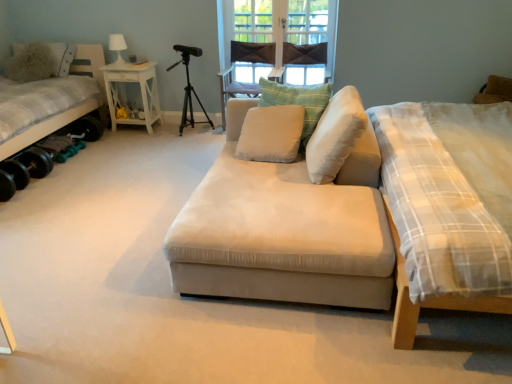
What are the coordinates of `free space to the left of beige fabric couch at center` in the screenshot? It's located at (106, 246).